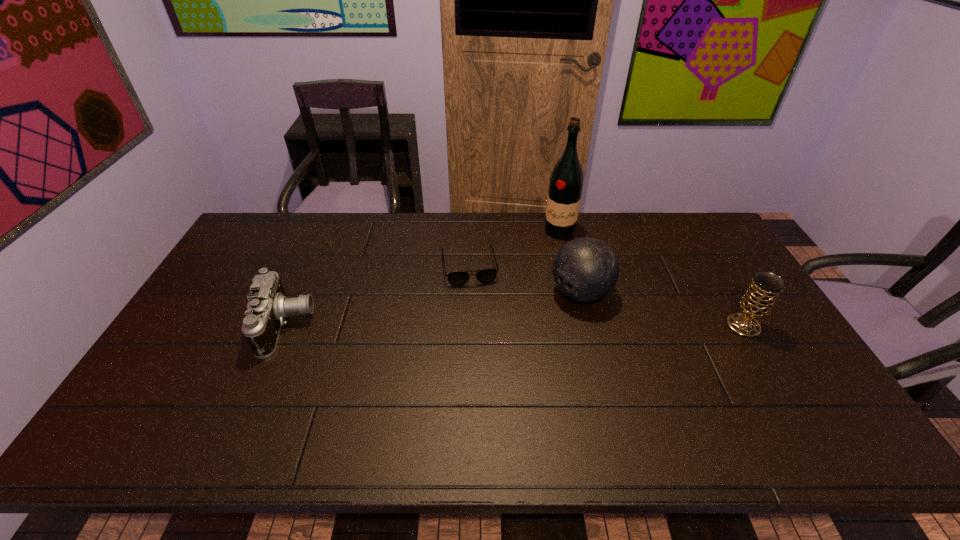
Locate an element on the screen. The height and width of the screenshot is (540, 960). free location that satisfies the following two spatial constraints: 1. on the front side of the chalice; 2. on the left side of the fourth object from right to left is located at coordinates (468, 326).